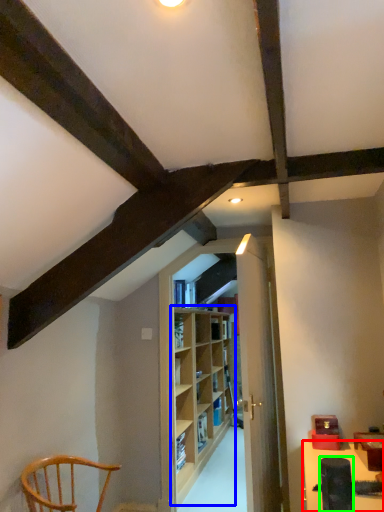
Question: Which object is the closest to the table (highlighted by a red box)? Choose among these: shelf (highlighted by a blue box) or lift (highlighted by a green box).

Choices:
 (A) shelf
 (B) lift

Answer: (B)